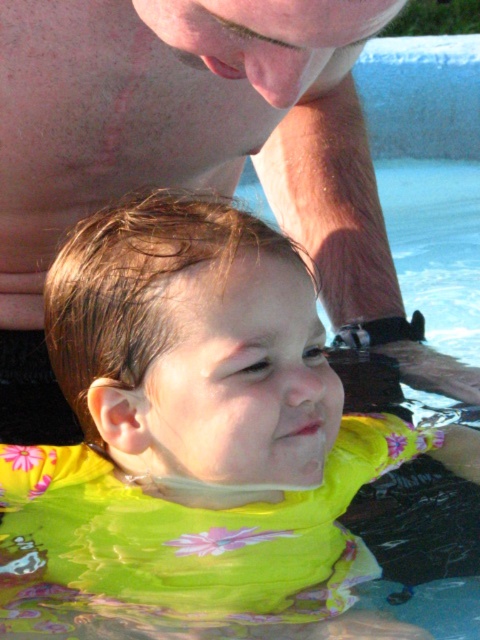
How distant is yellow fabric float at center from pink skin at upper center?

yellow fabric float at center is 10.16 inches from pink skin at upper center.

Which is below, yellow fabric float at center or pink skin at upper center?

yellow fabric float at center is lower down.

Find the location of a particular element. This screenshot has width=480, height=640. yellow fabric float at center is located at coordinates (194, 433).

Locate an element on the screen. This screenshot has width=480, height=640. yellow fabric float at center is located at coordinates (194, 433).